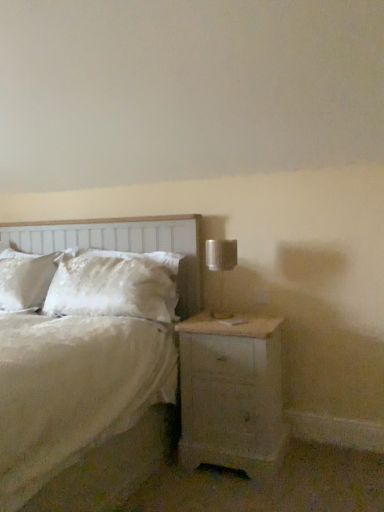
Question: From a real-world perspective, is white painted wood nightstand at lower right beneath white wood headboard at left?

Choices:
 (A) yes
 (B) no

Answer: (A)

Question: Would you say white painted wood nightstand at lower right is a long distance from white wood headboard at left?

Choices:
 (A) no
 (B) yes

Answer: (A)

Question: Does white painted wood nightstand at lower right have a smaller size compared to white wood headboard at left?

Choices:
 (A) no
 (B) yes

Answer: (B)

Question: Is white painted wood nightstand at lower right closer to the viewer compared to white wood headboard at left?

Choices:
 (A) yes
 (B) no

Answer: (A)

Question: Can you confirm if white painted wood nightstand at lower right is shorter than white wood headboard at left?

Choices:
 (A) no
 (B) yes

Answer: (B)

Question: Visually, is white wood headboard at left positioned to the left or to the right of white fluffy pillow at center?

Choices:
 (A) right
 (B) left

Answer: (B)

Question: From a real-world perspective, is white wood headboard at left above or below white fluffy pillow at center?

Choices:
 (A) above
 (B) below

Answer: (A)

Question: Which is correct: white wood headboard at left is inside white fluffy pillow at center, or outside of it?

Choices:
 (A) inside
 (B) outside

Answer: (B)

Question: From the image's perspective, is white wood headboard at left above or below white fluffy pillow at center?

Choices:
 (A) above
 (B) below

Answer: (A)

Question: From a real-world perspective, is white satin bed at center positioned above or below white fluffy pillow at center?

Choices:
 (A) below
 (B) above

Answer: (A)

Question: Would you say white satin bed at center is to the left or to the right of white fluffy pillow at center in the picture?

Choices:
 (A) right
 (B) left

Answer: (B)

Question: Which is correct: white satin bed at center is inside white fluffy pillow at center, or outside of it?

Choices:
 (A) outside
 (B) inside

Answer: (A)

Question: Considering the positions of white satin bed at center and white fluffy pillow at center in the image, is white satin bed at center bigger or smaller than white fluffy pillow at center?

Choices:
 (A) small
 (B) big

Answer: (B)

Question: Considering the positions of white wood headboard at left and metallic silver table lamp at right in the image, is white wood headboard at left taller or shorter than metallic silver table lamp at right?

Choices:
 (A) short
 (B) tall

Answer: (B)

Question: Does point (180, 315) appear closer or farther from the camera than point (226, 243)?

Choices:
 (A) closer
 (B) farther

Answer: (B)